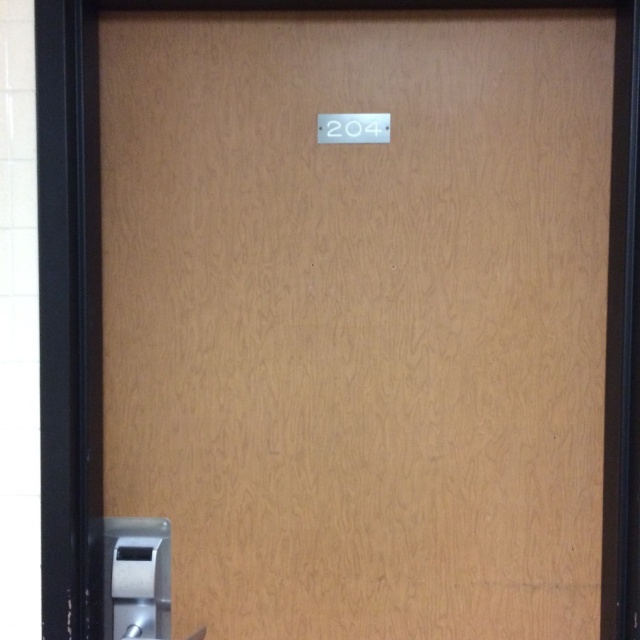
What do you see at coordinates (136, 579) in the screenshot?
I see `satin nickel door handle at bottom left` at bounding box center [136, 579].

Is satin nickel door handle at bottom left to the right of white glossy door lock at upper center from the viewer's perspective?

No, satin nickel door handle at bottom left is not to the right of white glossy door lock at upper center.

I want to click on satin nickel door handle at bottom left, so click(136, 579).

Locate an element on the screen. The image size is (640, 640). satin nickel door handle at bottom left is located at coordinates (136, 579).